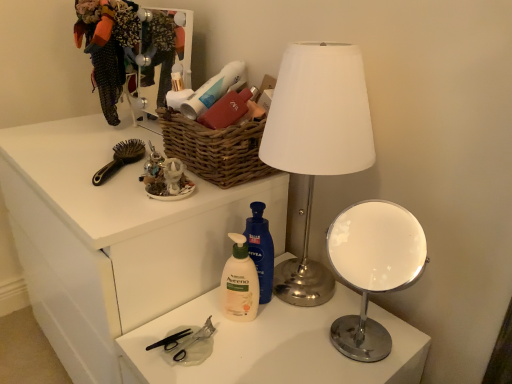
At what (x,y) coordinates should I click in order to perform the action: click on vacant region to the right of white matte lotion at center, which is counted as the first cleaning product, starting from the left. Please return your answer as a coordinate pair (x, y). This screenshot has width=512, height=384. Looking at the image, I should click on (311, 331).